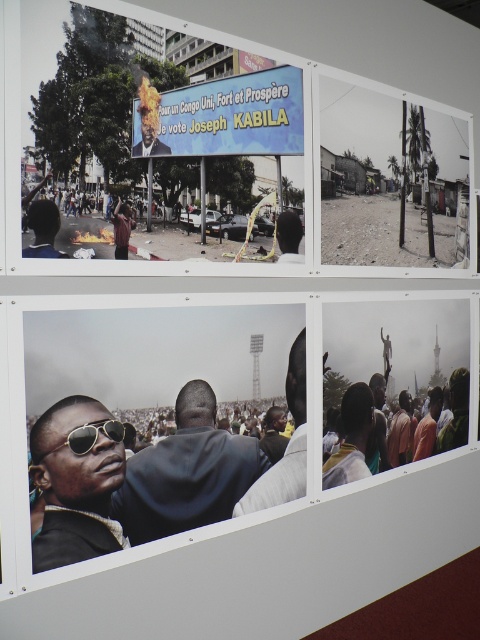
Question: Estimate the real-world distances between objects in this image. Which object is farther from the dark skin textured face at center?

Choices:
 (A) matte plastic billboard at upper center
 (B) dark blue suit at center
 (C) matte black sunglasses at upper left
 (D) matte black sunglasses at center

Answer: (C)

Question: Is matte black sunglasses at upper left wider than dark skin textured face at center?

Choices:
 (A) no
 (B) yes

Answer: (A)

Question: Which object is positioned farthest from the dark skin textured face at center?

Choices:
 (A) sunglasses at center
 (B) dark blue suit at center
 (C) sunglasses at lower left
 (D) matte black sunglasses at center

Answer: (C)

Question: Can you confirm if sunglasses at lower left is smaller than dark skin textured face at center?

Choices:
 (A) yes
 (B) no

Answer: (B)

Question: Which object is closer to the camera taking this photo?

Choices:
 (A) matte black sunglasses at center
 (B) dark skin textured face at center
 (C) dark blue suit at center
 (D) sunglasses at center

Answer: (D)

Question: Does dark blue suit at center appear on the right side of matte plastic billboard at upper center?

Choices:
 (A) yes
 (B) no

Answer: (B)